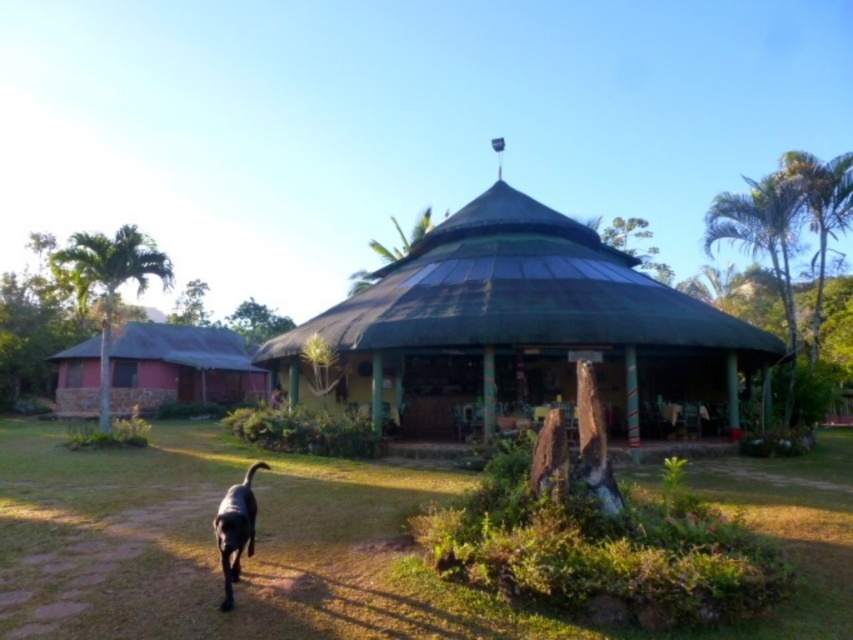
Question: Which point is farther from the camera taking this photo?

Choices:
 (A) (822, 493)
 (B) (369, 348)
 (C) (64, 392)
 (D) (218, 545)

Answer: (C)

Question: Which of the following is the farthest from the observer?

Choices:
 (A) (152, 349)
 (B) (229, 604)
 (C) (27, 596)
 (D) (479, 266)

Answer: (A)

Question: Which object is positioned closest to the green grass at center?

Choices:
 (A) green thatched roof gazebo at center
 (B) black glossy dog at lower left

Answer: (B)

Question: Does green thatched roof gazebo at center have a smaller size compared to matte red hut at left?

Choices:
 (A) no
 (B) yes

Answer: (A)

Question: Does green thatched roof gazebo at center appear on the right side of black glossy dog at lower left?

Choices:
 (A) yes
 (B) no

Answer: (A)

Question: From the image, what is the correct spatial relationship of green thatched roof gazebo at center in relation to black glossy dog at lower left?

Choices:
 (A) right
 (B) left

Answer: (A)